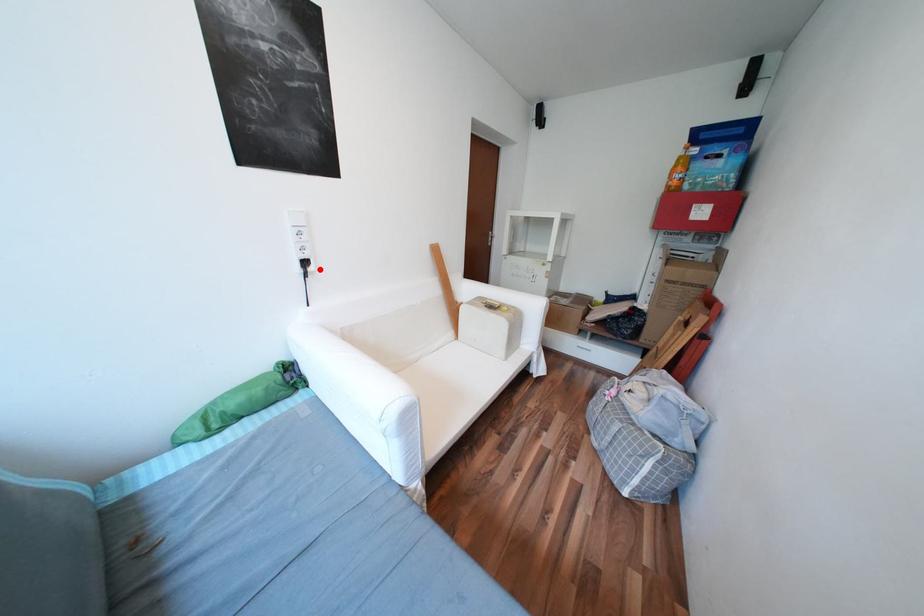
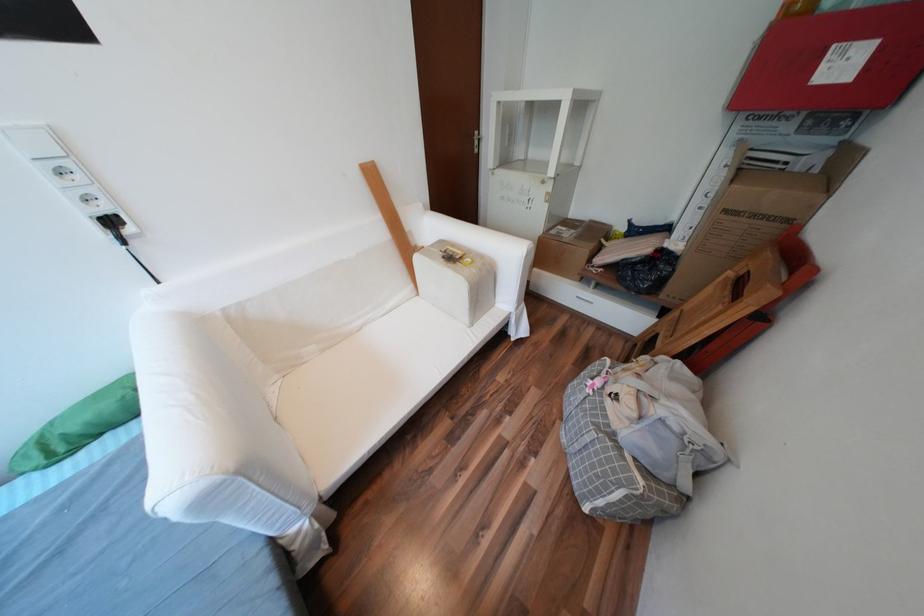
Where in the second image is the point corresponding to the highlighted location from the first image?

(138, 231)